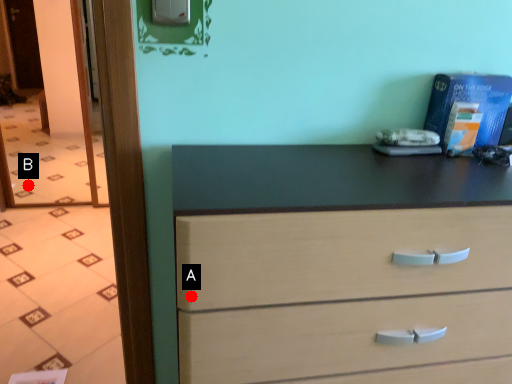
Question: Two points are circled on the image, labeled by A and B beside each circle. Which point is closer to the camera?

Choices:
 (A) A is closer
 (B) B is closer

Answer: (A)